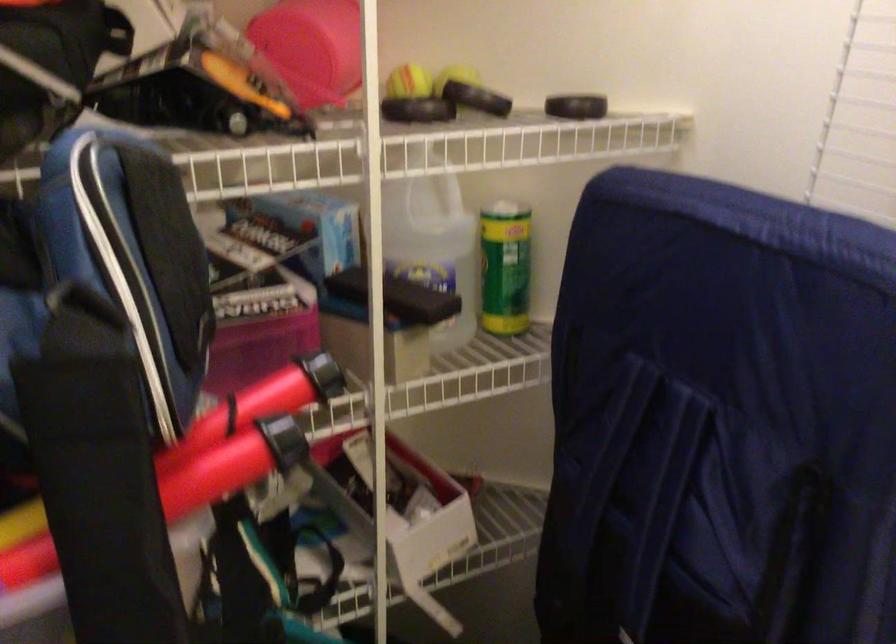
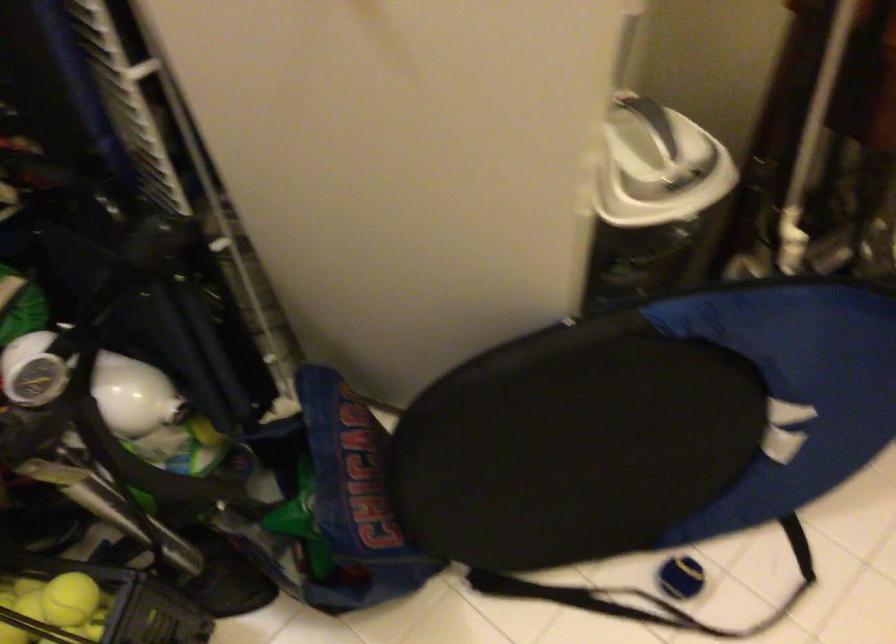
Question: How did the camera likely rotate?

Choices:
 (A) Left
 (B) Right
 (C) Up
 (D) Down

Answer: (D)